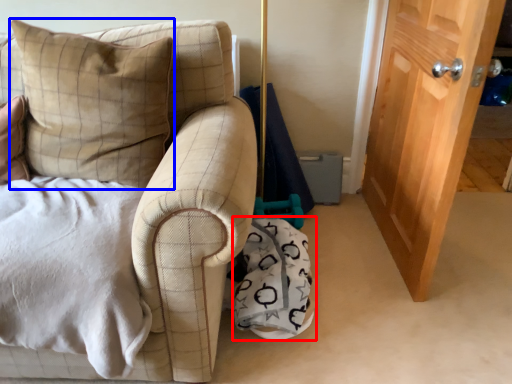
Question: Which point is further to the camera, material (highlighted by a red box) or pillow (highlighted by a blue box)?

Choices:
 (A) material
 (B) pillow

Answer: (A)